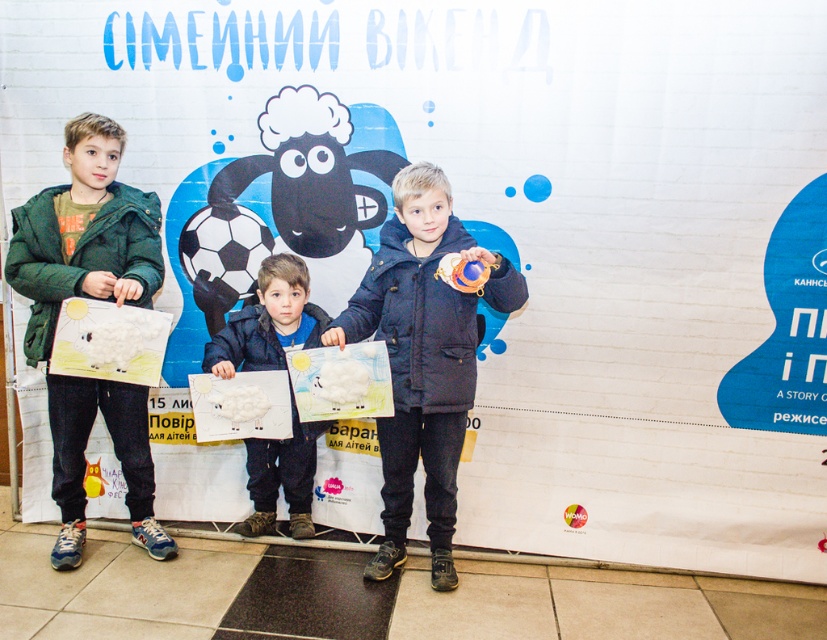
Which is below, green matte jacket at left or matte white paper at center?

matte white paper at center

Who is more distant from viewer, (113, 417) or (292, 492)?

The point (292, 492) is behind.

This screenshot has height=640, width=827. Find the location of `green matte jacket at left`. green matte jacket at left is located at coordinates (94, 298).

Does green matte jacket at left come behind dark blue jacket at center?

That is True.

Can you confirm if green matte jacket at left is wider than dark blue jacket at center?

No.

Which is behind, point (68, 529) or point (418, 429)?

Positioned behind is point (68, 529).

This screenshot has width=827, height=640. Find the location of `green matte jacket at left`. green matte jacket at left is located at coordinates (94, 298).

At what (x,y) coordinates should I click in order to perform the action: click on dark blue jacket at center. Please return your answer as a coordinate pair (x, y). Looking at the image, I should click on click(x=422, y=356).

What do you see at coordinates (422, 356) in the screenshot?
I see `dark blue jacket at center` at bounding box center [422, 356].

Measure the distance between dark blue jacket at center and camera.

They are 2.38 meters apart.

Find the location of `dark blue jacket at center`. dark blue jacket at center is located at coordinates (422, 356).